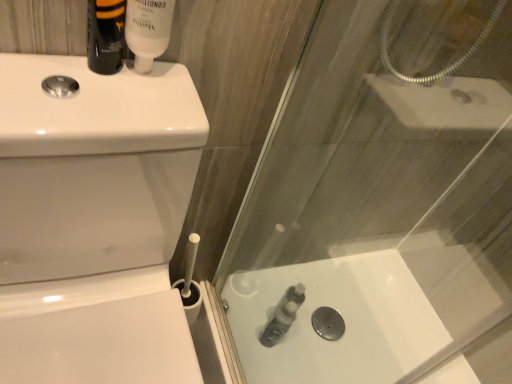
At what (x,y) coordinates should I click in order to perform the action: click on matte black bottle at upper left, the second toiletry in the bottom-to-top sequence. Please return your answer as a coordinate pair (x, y). This screenshot has width=512, height=384. Looking at the image, I should click on (105, 35).

The height and width of the screenshot is (384, 512). Find the location of `translucent plastic bottle at lower center, placed as the third toiletry when sorted from top to bottom`. translucent plastic bottle at lower center, placed as the third toiletry when sorted from top to bottom is located at coordinates (278, 323).

Image resolution: width=512 pixels, height=384 pixels. What do you see at coordinates (343, 318) in the screenshot?
I see `translucent plastic bottle at lower center` at bounding box center [343, 318].

At what (x,y) coordinates should I click in order to perform the action: click on translucent plastic bottle at lower center. Please return your answer as a coordinate pair (x, y). This screenshot has width=512, height=384. Looking at the image, I should click on (343, 318).

The image size is (512, 384). Identify the location of white glossy toilet bowl at left. (94, 222).

Is translucent plastic bottle at lower center, which is counted as the 3th toiletry, starting from the left, aimed at translucent plastic bottle at lower center?

No, translucent plastic bottle at lower center, which is counted as the 3th toiletry, starting from the left, is not turned towards translucent plastic bottle at lower center.

Which is closer to the camera, (287, 315) or (354, 374)?

Positioned in front is point (354, 374).

From a real-world perspective, relative to translucent plastic bottle at lower center, is translucent plastic bottle at lower center, which is counted as the 3th toiletry, starting from the left, vertically above or below?

translucent plastic bottle at lower center, which is counted as the 3th toiletry, starting from the left, is above translucent plastic bottle at lower center.

Can translucent plastic bottle at lower center be found inside translucent plastic bottle at lower center, arranged as the 3th toiletry when viewed from the front?

No, translucent plastic bottle at lower center is located outside of translucent plastic bottle at lower center, arranged as the 3th toiletry when viewed from the front.

Consider the image. Is white glossy tube at upper center, arranged as the second toiletry when viewed from the right, spatially inside translucent plastic bottle at lower center, or outside of it?

white glossy tube at upper center, arranged as the second toiletry when viewed from the right, is not enclosed by translucent plastic bottle at lower center.

Is white glossy tube at upper center, arranged as the second toiletry when viewed from the right, positioned with its back to translucent plastic bottle at lower center?

No.

Is white glossy tube at upper center, the second toiletry positioned from the front, in contact with translucent plastic bottle at lower center?

white glossy tube at upper center, the second toiletry positioned from the front, is not next to translucent plastic bottle at lower center, and they're not touching.

Which of these two, white glossy tube at upper center, the second toiletry positioned from the front, or translucent plastic bottle at lower center, is thinner?

With smaller width is white glossy tube at upper center, the second toiletry positioned from the front.

Could you tell me if white glossy toilet bowl at left is turned towards translucent plastic bottle at lower center, positioned as the first toiletry in right-to-left order?

No, white glossy toilet bowl at left is not oriented towards translucent plastic bottle at lower center, positioned as the first toiletry in right-to-left order.

From the image's perspective, which is above, white glossy toilet bowl at left or translucent plastic bottle at lower center, the 1th toiletry positioned from the back?

white glossy toilet bowl at left.

Is white glossy toilet bowl at left at the left side of translucent plastic bottle at lower center, positioned as the first toiletry in right-to-left order?

Correct, you'll find white glossy toilet bowl at left to the left of translucent plastic bottle at lower center, positioned as the first toiletry in right-to-left order.

From the image's perspective, is translucent plastic bottle at lower center, marked as the 1th toiletry in a bottom-to-top arrangement, above white glossy toilet bowl at left?

No.

Does point (271, 338) appear closer or farther from the camera than point (143, 286)?

Point (271, 338) is farther from the camera than point (143, 286).

Are translucent plastic bottle at lower center, placed as the third toiletry when sorted from top to bottom, and white glossy toilet bowl at left making contact?

No, translucent plastic bottle at lower center, placed as the third toiletry when sorted from top to bottom, is not making contact with white glossy toilet bowl at left.

From a real-world perspective, which is physically below, translucent plastic bottle at lower center, which is counted as the 3th toiletry, starting from the left, or white glossy toilet bowl at left?

translucent plastic bottle at lower center, which is counted as the 3th toiletry, starting from the left.

Considering the points (406, 305) and (157, 22), which point is in front, point (406, 305) or point (157, 22)?

The point (157, 22) is more forward.

Measure the distance between translucent plastic bottle at lower center and white glossy tube at upper center, arranged as the second toiletry when viewed from the right.

The distance of translucent plastic bottle at lower center from white glossy tube at upper center, arranged as the second toiletry when viewed from the right, is 31.76 inches.

From a real-world perspective, which is physically above, translucent plastic bottle at lower center or white glossy tube at upper center, acting as the second toiletry starting from the back?

white glossy tube at upper center, acting as the second toiletry starting from the back, is physically above.

Who is smaller, translucent plastic bottle at lower center or white glossy tube at upper center, which ranks as the third toiletry in bottom-to-top order?

Smaller between the two is white glossy tube at upper center, which ranks as the third toiletry in bottom-to-top order.

From a real-world perspective, between translucent plastic bottle at lower center and translucent plastic bottle at lower center, the 1th toiletry positioned from the back, who is vertically lower?

translucent plastic bottle at lower center, from a real-world perspective.

Is translucent plastic bottle at lower center beside translucent plastic bottle at lower center, which is counted as the 3th toiletry, starting from the left?

No, translucent plastic bottle at lower center is not with translucent plastic bottle at lower center, which is counted as the 3th toiletry, starting from the left.

Considering the points (340, 369) and (284, 332), which point is in front, point (340, 369) or point (284, 332)?

The point (340, 369) is closer to the camera.

Which object is further away from the camera, translucent plastic bottle at lower center or translucent plastic bottle at lower center, arranged as the 3th toiletry when viewed from the front?

translucent plastic bottle at lower center, arranged as the 3th toiletry when viewed from the front, is further from the camera.

Who is bigger, translucent plastic bottle at lower center, positioned as the first toiletry in right-to-left order, or white glossy tube at upper center, the second toiletry positioned from the front?

translucent plastic bottle at lower center, positioned as the first toiletry in right-to-left order, is bigger.

The width and height of the screenshot is (512, 384). In order to click on the 1st toiletry counting from the left side of the translucent plastic bottle at lower center, placed as the third toiletry when sorted from top to bottom in this screenshot , I will do `click(148, 30)`.

Are translucent plastic bottle at lower center, positioned as the first toiletry in right-to-left order, and white glossy tube at upper center, the second toiletry positioned from the front, beside each other?

No, translucent plastic bottle at lower center, positioned as the first toiletry in right-to-left order, is not making contact with white glossy tube at upper center, the second toiletry positioned from the front.

Based on the photo, is translucent plastic bottle at lower center, positioned as the first toiletry in right-to-left order, to the left or to the right of white glossy tube at upper center, acting as the second toiletry starting from the back, in the image?

Based on their positions, translucent plastic bottle at lower center, positioned as the first toiletry in right-to-left order, is located to the right of white glossy tube at upper center, acting as the second toiletry starting from the back.

Which toiletry is the 1st one when counting from the left side of the translucent plastic bottle at lower center? Please provide its 2D coordinates.

[(278, 323)]

What are the coordinates of `toiletry that is the 3rd one above the translucent plastic bottle at lower center (from a real-world perspective)` in the screenshot? It's located at [x=148, y=30].

Looking at the image, which one is located closer to translucent plastic bottle at lower center, the 1th toiletry positioned from the back, translucent plastic bottle at lower center or white glossy tube at upper center, arranged as the second toiletry when viewed from the right?

Among the two, translucent plastic bottle at lower center is located nearer to translucent plastic bottle at lower center, the 1th toiletry positioned from the back.

Which object lies further to the anchor point translucent plastic bottle at lower center, positioned as the first toiletry in right-to-left order, white glossy toilet bowl at left or matte black bottle at upper left, the 3th toiletry when ordered from right to left?

Based on the image, matte black bottle at upper left, the 3th toiletry when ordered from right to left, appears to be further to translucent plastic bottle at lower center, positioned as the first toiletry in right-to-left order.

Looking at the image, which one is located closer to matte black bottle at upper left, the first toiletry viewed from the left, white glossy tube at upper center, acting as the second toiletry starting from the back, or translucent plastic bottle at lower center, marked as the 1th toiletry in a bottom-to-top arrangement?

white glossy tube at upper center, acting as the second toiletry starting from the back, lies closer to matte black bottle at upper left, the first toiletry viewed from the left, than the other object.

Estimate the real-world distances between objects in this image. Which object is further from translucent plastic bottle at lower center, the 1th toiletry positioned from the back, white glossy tube at upper center, which ranks as the third toiletry in bottom-to-top order, or translucent plastic bottle at lower center?

white glossy tube at upper center, which ranks as the third toiletry in bottom-to-top order, is positioned further to the anchor translucent plastic bottle at lower center, the 1th toiletry positioned from the back.

Which object lies further to the anchor point white glossy toilet bowl at left, matte black bottle at upper left, the 3th toiletry positioned from the back, or white glossy tube at upper center, which ranks as the third toiletry in bottom-to-top order?

white glossy tube at upper center, which ranks as the third toiletry in bottom-to-top order.

Considering their positions, is translucent plastic bottle at lower center, placed as the third toiletry when sorted from top to bottom, positioned closer to translucent plastic bottle at lower center than matte black bottle at upper left, the 2th toiletry from the top?

translucent plastic bottle at lower center, placed as the third toiletry when sorted from top to bottom, is positioned closer to the anchor translucent plastic bottle at lower center.

Which object lies nearer to the anchor point translucent plastic bottle at lower center, white glossy tube at upper center, which ranks as the third toiletry in bottom-to-top order, or translucent plastic bottle at lower center, placed as the third toiletry when sorted from top to bottom?

The object closer to translucent plastic bottle at lower center is translucent plastic bottle at lower center, placed as the third toiletry when sorted from top to bottom.

Considering their positions, is matte black bottle at upper left, the 1th toiletry positioned from the front, positioned closer to white glossy toilet bowl at left than translucent plastic bottle at lower center?

Among the two, matte black bottle at upper left, the 1th toiletry positioned from the front, is located nearer to white glossy toilet bowl at left.

Image resolution: width=512 pixels, height=384 pixels. Identify the location of toiletry between matte black bottle at upper left, the second toiletry in the bottom-to-top sequence, and translucent plastic bottle at lower center, placed as the third toiletry when sorted from top to bottom, in the front-back direction. (148, 30).

Find the location of `toiletry between white glossy tube at upper center, which is the 2th toiletry in left-to-right order, and white glossy toilet bowl at left in the up-down direction`. toiletry between white glossy tube at upper center, which is the 2th toiletry in left-to-right order, and white glossy toilet bowl at left in the up-down direction is located at coordinates (105, 35).

Where is `bath between white glossy toilet bowl at left and translucent plastic bottle at lower center, arranged as the 3th toiletry when viewed from the front, along the z-axis`? bath between white glossy toilet bowl at left and translucent plastic bottle at lower center, arranged as the 3th toiletry when viewed from the front, along the z-axis is located at coordinates (343, 318).

Image resolution: width=512 pixels, height=384 pixels. Identify the location of toiletry between matte black bottle at upper left, the first toiletry viewed from the left, and translucent plastic bottle at lower center in the up-down direction. (278, 323).